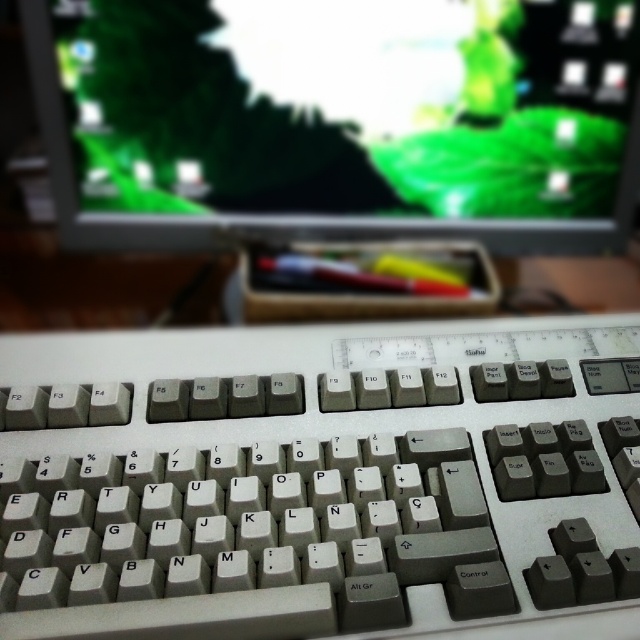
Question: Is the position of white plastic keyboard at center more distant than that of matte plastic monitor at upper center?

Choices:
 (A) no
 (B) yes

Answer: (A)

Question: Is white plastic keyboard at center to the left of matte plastic monitor at upper center from the viewer's perspective?

Choices:
 (A) yes
 (B) no

Answer: (A)

Question: Among these points, which one is nearest to the camera?

Choices:
 (A) (500, 481)
 (B) (493, 131)

Answer: (A)

Question: Among these objects, which one is nearest to the camera?

Choices:
 (A) matte plastic monitor at upper center
 (B) white plastic keyboard at center

Answer: (B)

Question: Does white plastic keyboard at center appear on the right side of matte plastic monitor at upper center?

Choices:
 (A) no
 (B) yes

Answer: (A)